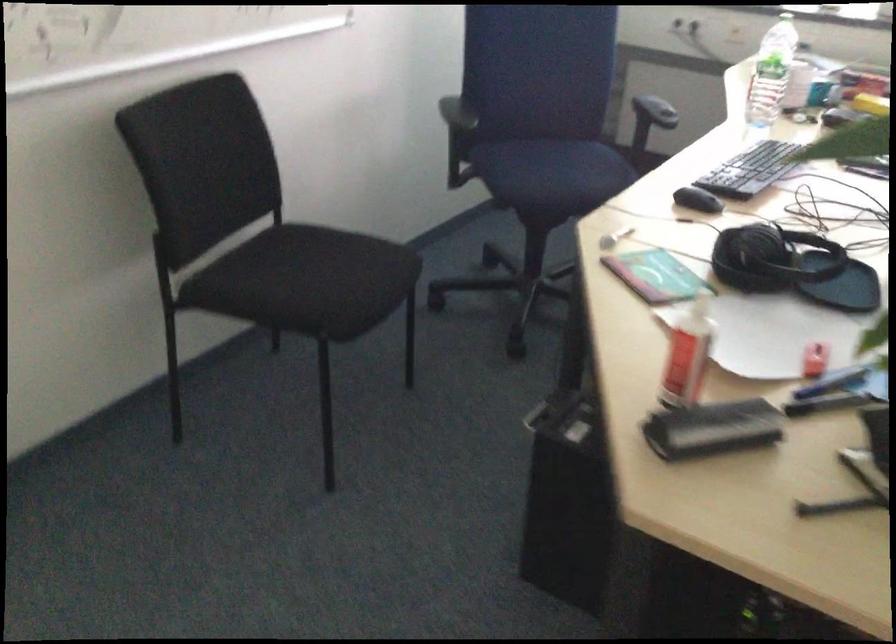
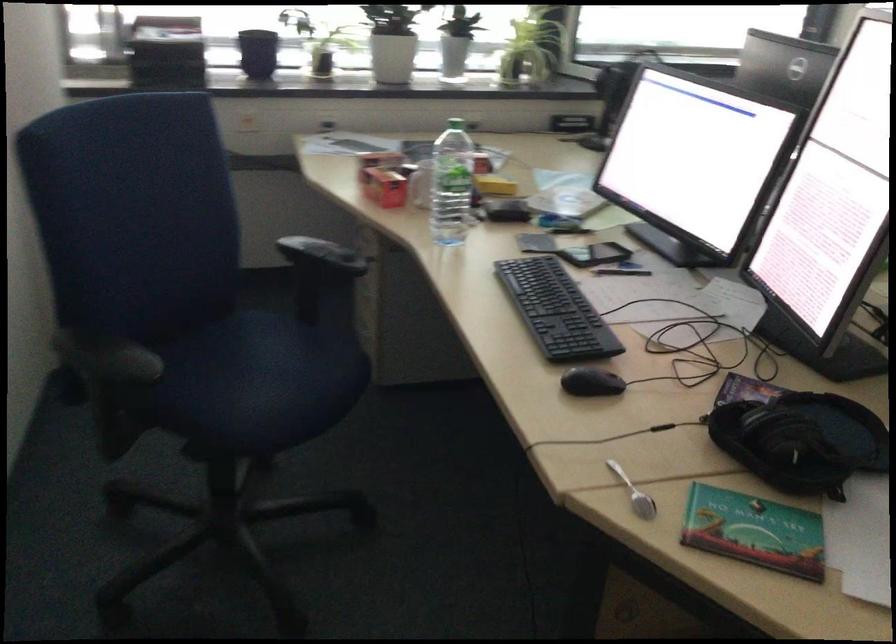
In the second image, find the point that corresponds to pixel 690 198 in the first image.

(590, 382)